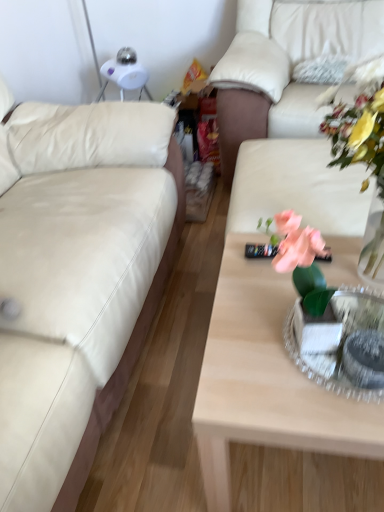
Question: Is white leather couch at upper right, which appears as the first studio couch when viewed from the right, positioned before light wood coffee table at center?

Choices:
 (A) no
 (B) yes

Answer: (A)

Question: Considering the relative sizes of white leather couch at upper right, which appears as the first studio couch when viewed from the right, and light wood coffee table at center in the image provided, is white leather couch at upper right, which appears as the first studio couch when viewed from the right, shorter than light wood coffee table at center?

Choices:
 (A) yes
 (B) no

Answer: (B)

Question: From a real-world perspective, does white leather couch at upper right, which is the second studio couch in left-to-right order, stand above light wood coffee table at center?

Choices:
 (A) yes
 (B) no

Answer: (A)

Question: Is white leather couch at upper right, which appears as the first studio couch when viewed from the right, next to light wood coffee table at center and touching it?

Choices:
 (A) yes
 (B) no

Answer: (B)

Question: Is white leather couch at upper right, which is the second studio couch in left-to-right order, oriented towards light wood coffee table at center?

Choices:
 (A) yes
 (B) no

Answer: (A)

Question: Is beige leather couch at left, the 1th studio couch from the left, situated inside light wood coffee table at center or outside?

Choices:
 (A) inside
 (B) outside

Answer: (B)

Question: Does point (52, 394) appear closer or farther from the camera than point (264, 303)?

Choices:
 (A) farther
 (B) closer

Answer: (B)

Question: Is beige leather couch at left, the 1th studio couch from the left, in front of or behind light wood coffee table at center in the image?

Choices:
 (A) front
 (B) behind

Answer: (A)

Question: Considering the positions of beige leather couch at left, the 2th studio couch from the right, and light wood coffee table at center in the image, is beige leather couch at left, the 2th studio couch from the right, taller or shorter than light wood coffee table at center?

Choices:
 (A) short
 (B) tall

Answer: (B)

Question: From the image's perspective, is light wood coffee table at center located above or below metallic silver tray at center?

Choices:
 (A) above
 (B) below

Answer: (B)

Question: From a real-world perspective, is light wood coffee table at center positioned above or below metallic silver tray at center?

Choices:
 (A) above
 (B) below

Answer: (B)

Question: Considering the positions of light wood coffee table at center and metallic silver tray at center in the image, is light wood coffee table at center taller or shorter than metallic silver tray at center?

Choices:
 (A) tall
 (B) short

Answer: (A)

Question: Is point (365, 456) positioned closer to the camera than point (362, 322)?

Choices:
 (A) farther
 (B) closer

Answer: (A)

Question: Looking at their shapes, would you say metallic silver tray at center is wider or thinner than light wood coffee table at center?

Choices:
 (A) wide
 (B) thin

Answer: (B)

Question: From a real-world perspective, is metallic silver tray at center physically located above or below light wood coffee table at center?

Choices:
 (A) above
 (B) below

Answer: (A)